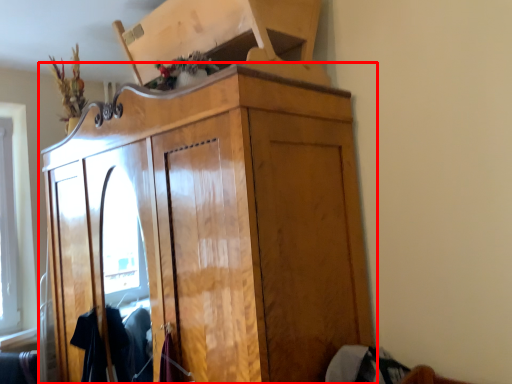
Question: From the image's perspective, what is the correct spatial relationship of cupboard (annotated by the red box) in relation to clothing?

Choices:
 (A) above
 (B) below

Answer: (A)